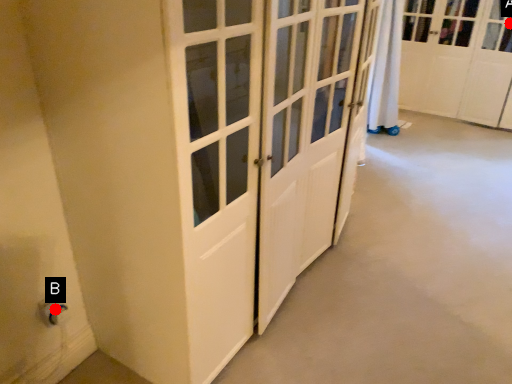
Question: Two points are circled on the image, labeled by A and B beside each circle. Among these points, which one is nearest to the camera?

Choices:
 (A) A is closer
 (B) B is closer

Answer: (B)